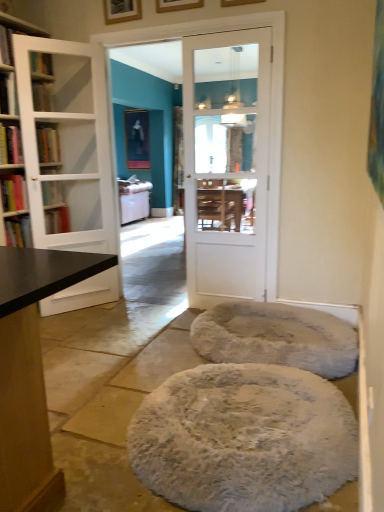
Question: Is point (334, 360) positioned closer to the camera than point (195, 96)?

Choices:
 (A) farther
 (B) closer

Answer: (B)

Question: Looking at the image, does white fluffy cat bed at center seem bigger or smaller compared to white glossy door at center, positioned as the first door in right-to-left order?

Choices:
 (A) big
 (B) small

Answer: (A)

Question: Which is farther from the white fluffy pouf at center?

Choices:
 (A) white glass door at left, which is counted as the second door, starting from the right
 (B) black matte bookshelf at left, which is the fourth book from top to bottom
 (C) matte black picture frame at upper center, which appears as the 1th picture frame when viewed from the left
 (D) white glossy door at center, which ranks as the second door in left-to-right order
 (E) white fluffy cat bed at center

Answer: (C)

Question: Estimate the real-world distances between objects in this image. Which object is closer to the hardcover book at left, the first book viewed from the top?

Choices:
 (A) wooden picture frame at upper center, which is counted as the 1th picture frame, starting from the right
 (B) hardcover book at left, the 2th book in the bottom-to-top sequence
 (C) wooden picture frame at upper center, acting as the 2th picture frame starting from the back
 (D) white glossy door at center, positioned as the first door in right-to-left order
 (E) hardcover book at left, which is the 2th book from top to bottom

Answer: (E)